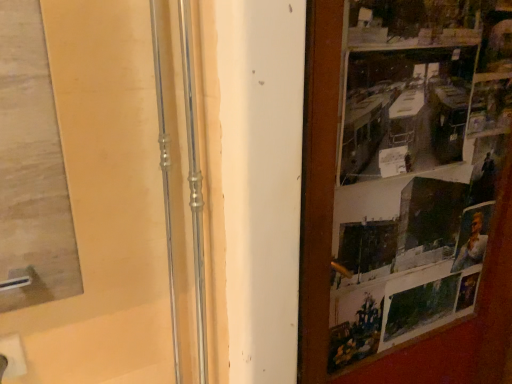
Question: Should I look upward or downward to see polished chrome shower door at center?

Choices:
 (A) down
 (B) up

Answer: (A)